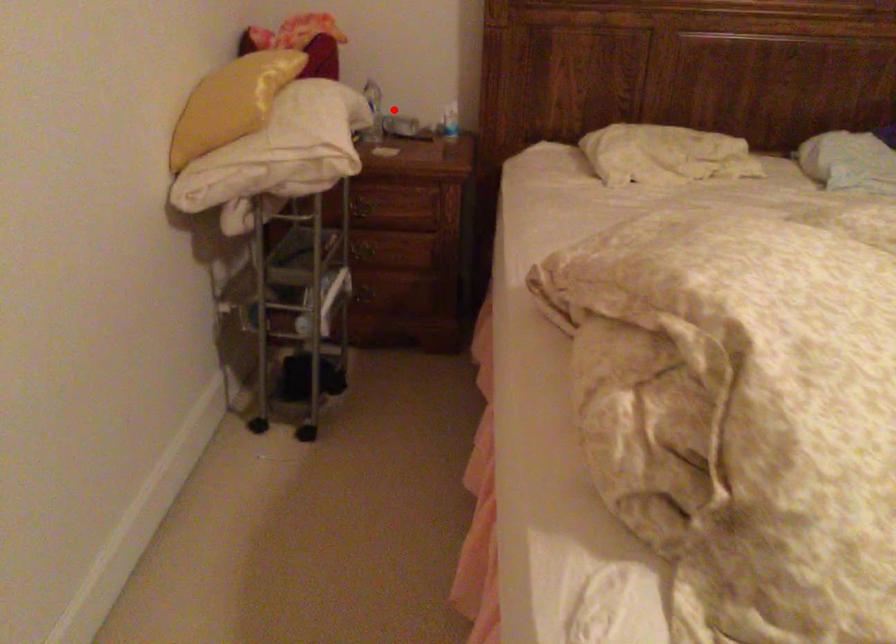
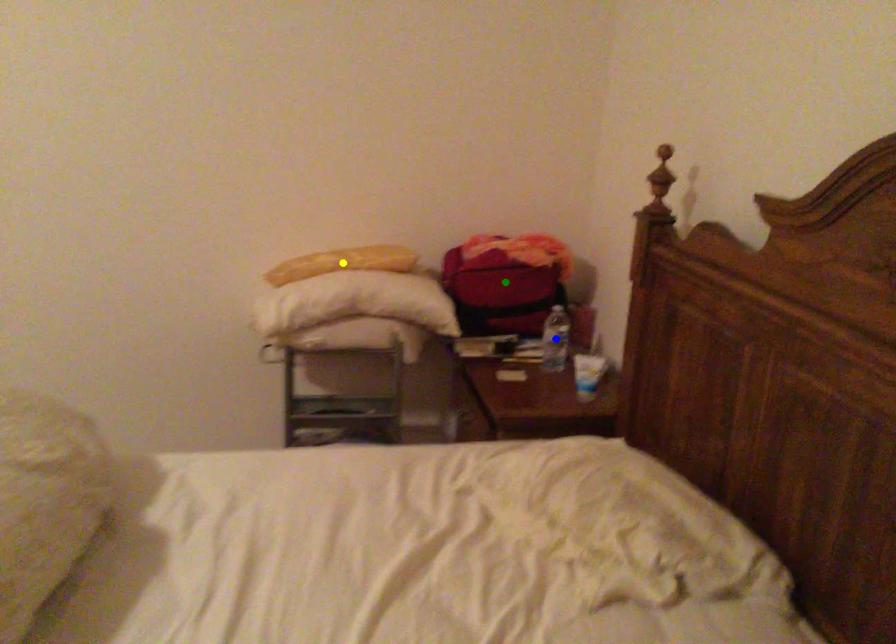
Question: I am providing you with two images of the same scene from different viewpoints. A red point is marked on the first image. You are given multiple points on the second image. Can you choose the point in image 2 that corresponds to the point in image 1?

Choices:
 (A) green point
 (B) blue point
 (C) yellow point

Answer: (B)